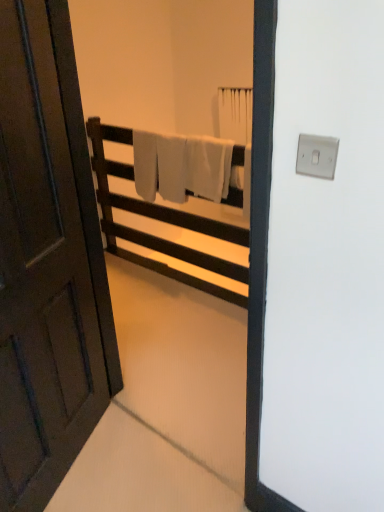
Question: Does white matte towel rack at center lie behind white soft towel at center?

Choices:
 (A) no
 (B) yes

Answer: (A)

Question: Considering the relative sizes of white matte towel rack at center and white soft towel at center in the image provided, is white matte towel rack at center smaller than white soft towel at center?

Choices:
 (A) yes
 (B) no

Answer: (B)

Question: From the image's perspective, is white matte towel rack at center located beneath white soft towel at center?

Choices:
 (A) yes
 (B) no

Answer: (A)

Question: Is white matte towel rack at center wider than white soft towel at center?

Choices:
 (A) yes
 (B) no

Answer: (A)

Question: Is white soft towel at center completely or partially inside white matte towel rack at center?

Choices:
 (A) no
 (B) yes

Answer: (B)

Question: Could you tell me if white matte towel rack at center is facing white soft towel at center?

Choices:
 (A) no
 (B) yes

Answer: (B)

Question: Can you confirm if white matte towel rack at center is wider than dark wood door at left?

Choices:
 (A) yes
 (B) no

Answer: (A)

Question: Is white matte towel rack at center shorter than dark wood door at left?

Choices:
 (A) yes
 (B) no

Answer: (A)

Question: From a real-world perspective, is white matte towel rack at center beneath dark wood door at left?

Choices:
 (A) no
 (B) yes

Answer: (B)

Question: Can you confirm if white matte towel rack at center is smaller than dark wood door at left?

Choices:
 (A) no
 (B) yes

Answer: (A)

Question: From the image's perspective, is white matte towel rack at center beneath dark wood door at left?

Choices:
 (A) no
 (B) yes

Answer: (A)

Question: Is the position of white matte towel rack at center less distant than that of dark wood door at left?

Choices:
 (A) yes
 (B) no

Answer: (B)

Question: Would you say white soft towel at center is outside white matte towel rack at center?

Choices:
 (A) no
 (B) yes

Answer: (A)